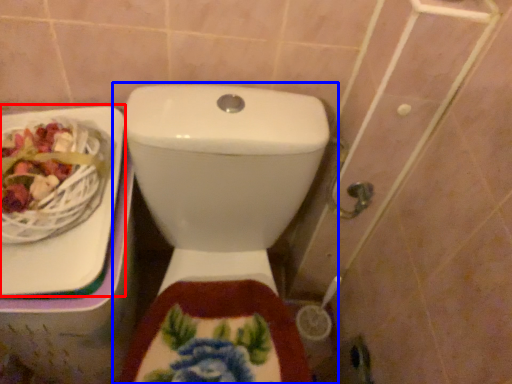
Question: Which point is further to the camera, sink (highlighted by a red box) or toilet (highlighted by a blue box)?

Choices:
 (A) sink
 (B) toilet

Answer: (A)